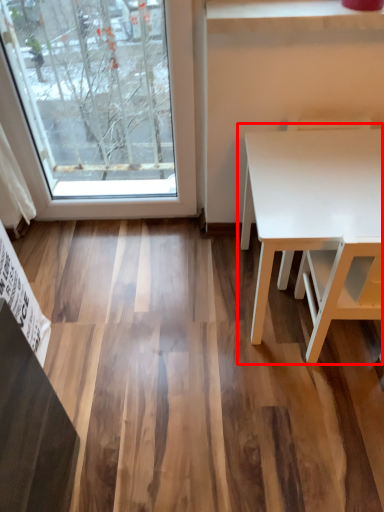
Question: Where is table (annotated by the red box) located in relation to chair in the image?

Choices:
 (A) right
 (B) left

Answer: (A)